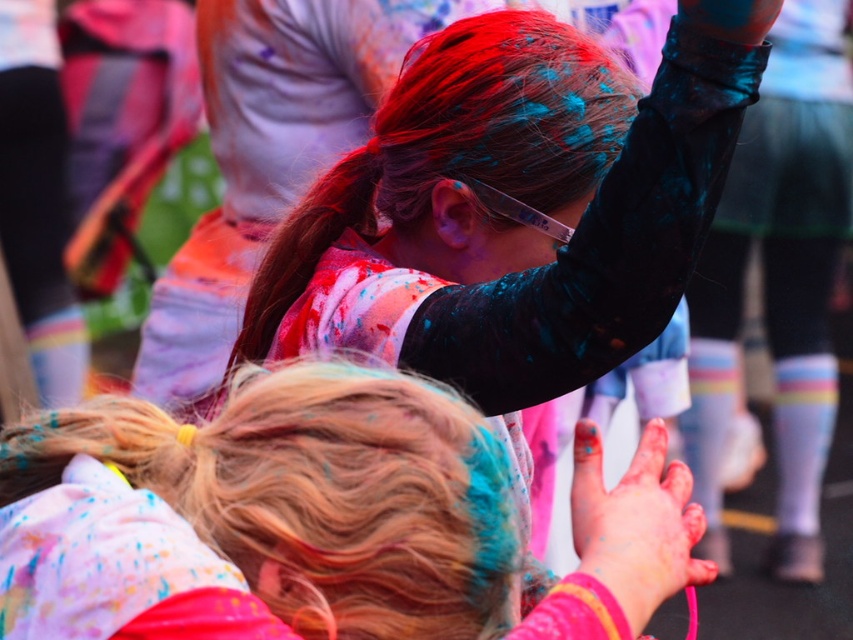
You are a photographer at the event and want to capture a closeup of the shiny red hair at upper center without the painted skin hand at center blocking it. Which direction should you move your camera to achieve this?

The shiny red hair at upper center is located above the painted skin hand at center, so moving the camera upwards will position the shiny red hair at upper center above the painted skin hand at center and avoid obstruction.

You are a photographer at a colorful event. You need to capture a photo where both the blonde hair at center and the shiny red hair at upper center are clearly visible. Given their sizes, which one might you need to adjust your camera focus for to ensure clarity?

The blonde hair at center is larger in size than the shiny red hair at upper center, so you should focus on the blonde hair at center to ensure clarity since larger objects often require more precise focus to capture all details.